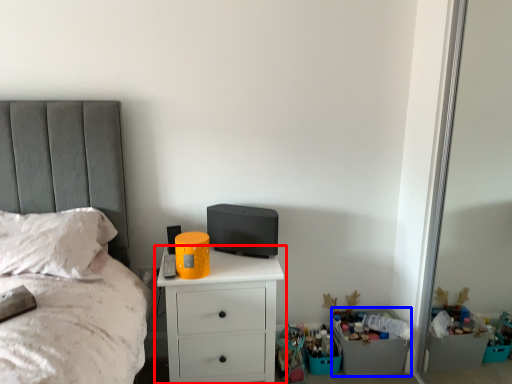
Question: Among these objects, which one is farthest to the camera, chest of drawers (highlighted by a red box) or crate (highlighted by a blue box)?

Choices:
 (A) chest of drawers
 (B) crate

Answer: (B)